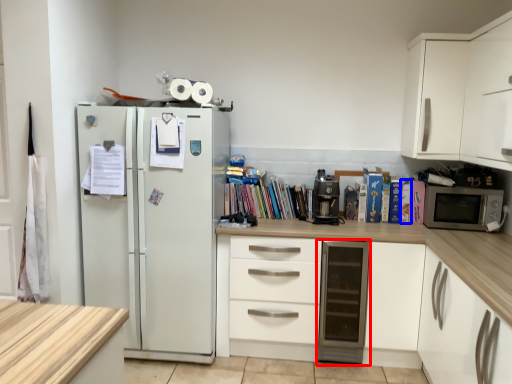
Question: Which of the following is the farthest to the observer, dish washer (highlighted by a red box) or paperback book (highlighted by a blue box)?

Choices:
 (A) dish washer
 (B) paperback book

Answer: (B)